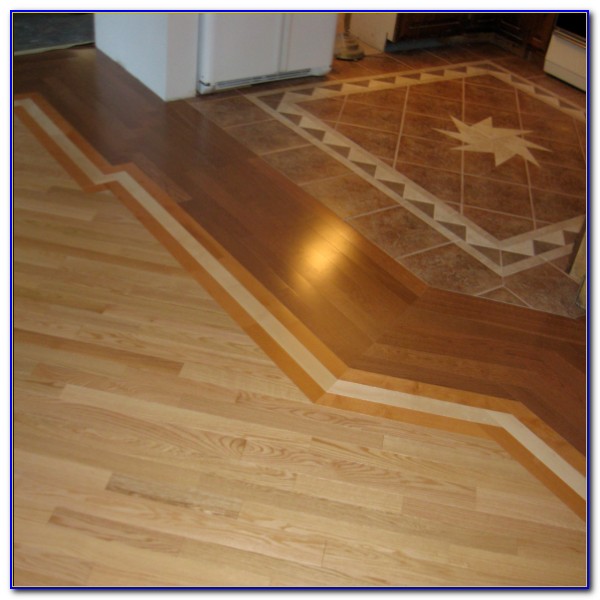
At what (x,y) coordinates should I click in order to perform the action: click on furniture or appliance. Please return your answer as a coordinate pair (x, y). Looking at the image, I should click on (557, 62).